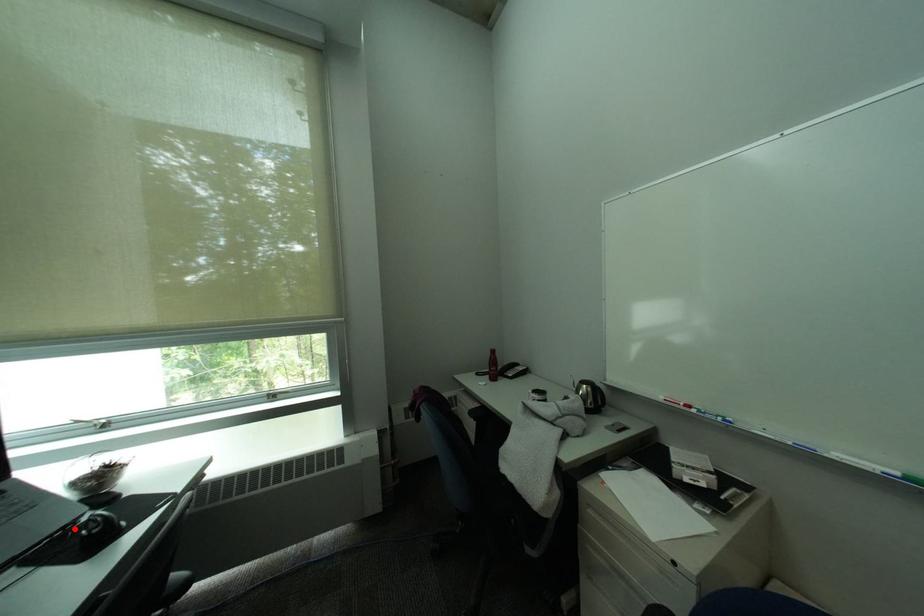
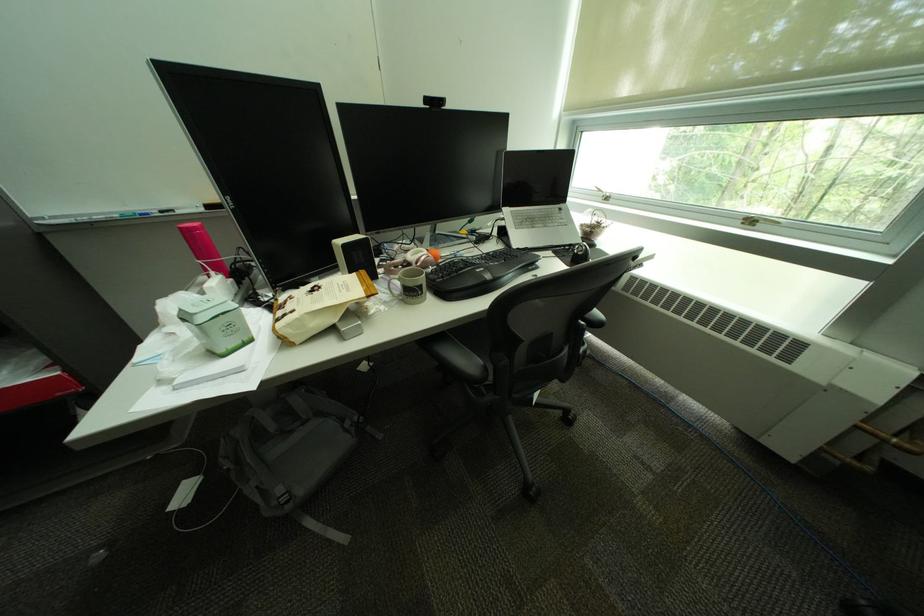
In the second image, find the point that corresponds to the highlighted location in the first image.

(580, 246)